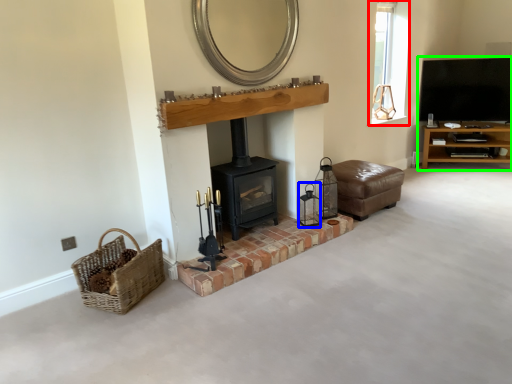
Question: Which object is positioned farthest from window (highlighted by a red box)? Select from candle holder (highlighted by a blue box) and entertainment center (highlighted by a green box).

Choices:
 (A) candle holder
 (B) entertainment center

Answer: (A)